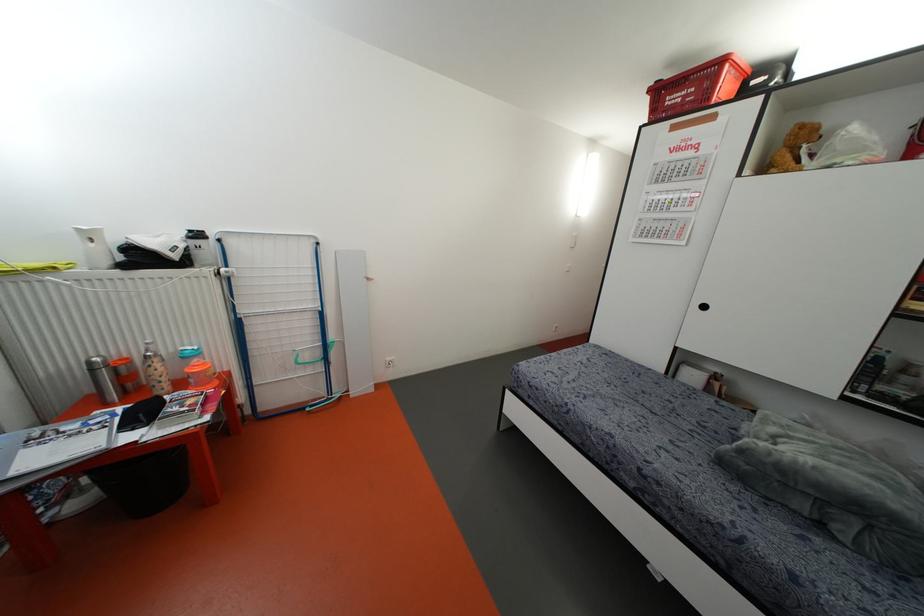
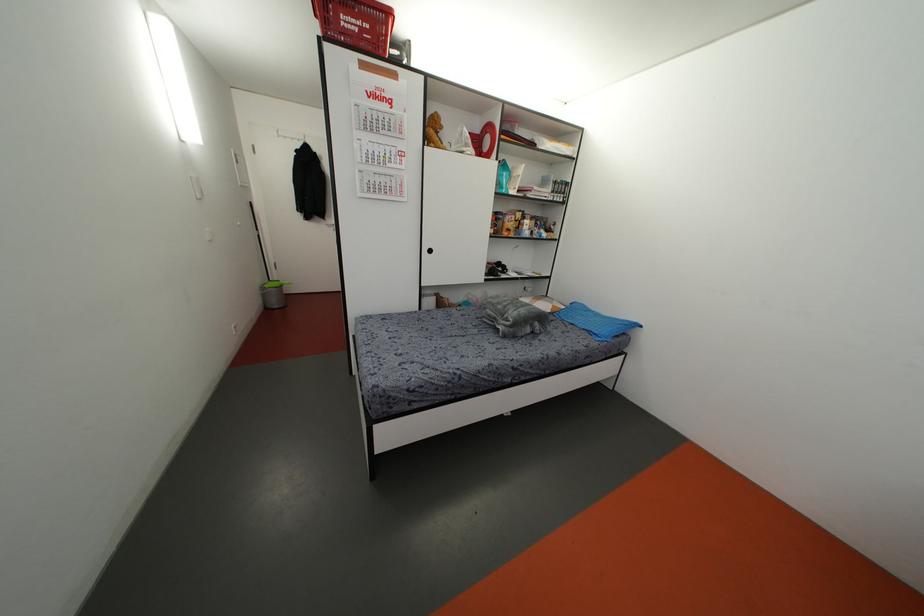
The point at (723, 60) is marked in the first image. Where is the corresponding point in the second image?

(388, 13)